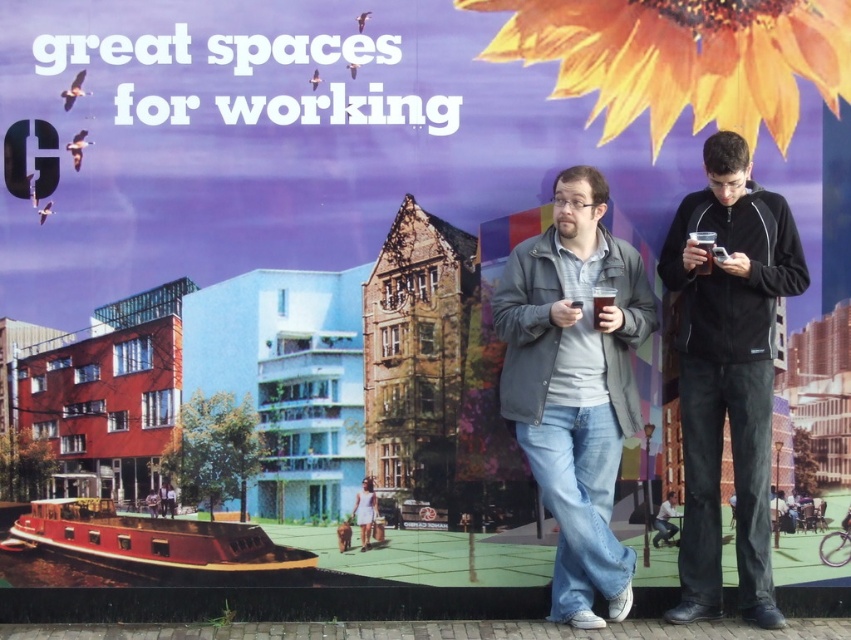
Question: Can you confirm if matte gray jacket at center is positioned below matte black jacket at center?

Choices:
 (A) yes
 (B) no

Answer: (B)

Question: Among these points, which one is farthest from the camera?

Choices:
 (A) (363, 499)
 (B) (166, 486)

Answer: (A)

Question: Which object appears closest to the camera in this image?

Choices:
 (A) white cotton dress at center
 (B) black smooth jacket at right
 (C) matte gray jacket at center
 (D) matte black jacket at center

Answer: (C)

Question: Does black smooth jacket at right have a smaller size compared to matte black jacket at center?

Choices:
 (A) yes
 (B) no

Answer: (B)

Question: Can you confirm if black smooth jacket at right is thinner than matte black jacket at center?

Choices:
 (A) no
 (B) yes

Answer: (A)

Question: Which point is farther to the camera?

Choices:
 (A) matte black jacket at center
 (B) white cotton dress at center
 (C) black smooth jacket at right

Answer: (B)